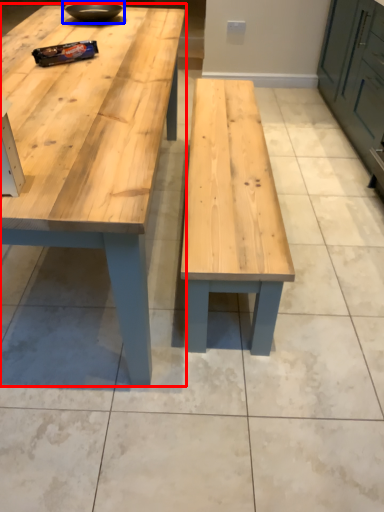
Question: Which point is closer to the camera, table (highlighted by a red box) or bowl (highlighted by a blue box)?

Choices:
 (A) table
 (B) bowl

Answer: (A)